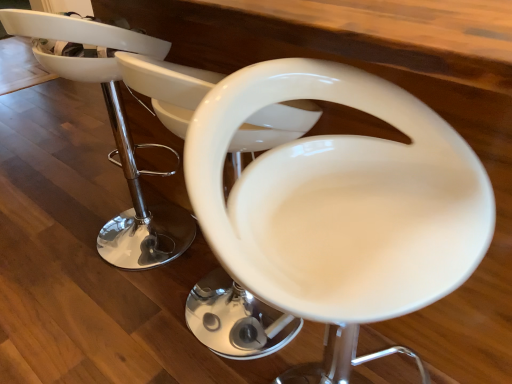
Question: Does white glossy bar stool at center, placed as the 2th feeding chair when sorted from back to front, have a lesser width compared to white glossy bar stool at center?

Choices:
 (A) no
 (B) yes

Answer: (B)

Question: Can you confirm if white glossy bar stool at center, placed as the 2th feeding chair when sorted from back to front, is taller than white glossy bar stool at center?

Choices:
 (A) yes
 (B) no

Answer: (B)

Question: Is white glossy bar stool at center, placed as the 2th feeding chair when sorted from back to front, positioned far away from white glossy bar stool at center?

Choices:
 (A) yes
 (B) no

Answer: (A)

Question: Does white glossy bar stool at center, marked as the 1th feeding chair in a front-to-back arrangement, have a smaller size compared to white glossy bar stool at center?

Choices:
 (A) yes
 (B) no

Answer: (A)

Question: From the image's perspective, is white glossy bar stool at center, marked as the 1th feeding chair in a front-to-back arrangement, located beneath white glossy bar stool at center?

Choices:
 (A) yes
 (B) no

Answer: (A)

Question: Is white glossy bar stool at center, marked as the 1th feeding chair in a front-to-back arrangement, at the left side of white glossy bar stool at center?

Choices:
 (A) no
 (B) yes

Answer: (A)

Question: Can you confirm if white glossy bar stool at center, which is the 1th feeding chair from back to front, is positioned to the left of white glossy bar stool at center, placed as the 2th feeding chair when sorted from back to front?

Choices:
 (A) no
 (B) yes

Answer: (B)

Question: Is white glossy bar stool at center, which is the 1th feeding chair from back to front, not within white glossy bar stool at center, marked as the 1th feeding chair in a front-to-back arrangement?

Choices:
 (A) yes
 (B) no

Answer: (A)

Question: Considering the relative sizes of white glossy bar stool at center, which is the 1th feeding chair from back to front, and white glossy bar stool at center, placed as the 2th feeding chair when sorted from back to front, in the image provided, is white glossy bar stool at center, which is the 1th feeding chair from back to front, smaller than white glossy bar stool at center, placed as the 2th feeding chair when sorted from back to front,?

Choices:
 (A) yes
 (B) no

Answer: (B)

Question: From the image's perspective, does white glossy bar stool at center, which is the 1th feeding chair from back to front, appear lower than white glossy bar stool at center, placed as the 2th feeding chair when sorted from back to front?

Choices:
 (A) no
 (B) yes

Answer: (A)

Question: Is white glossy bar stool at center, which is the 1th feeding chair from back to front, next to white glossy bar stool at center, placed as the 2th feeding chair when sorted from back to front, and touching it?

Choices:
 (A) no
 (B) yes

Answer: (A)

Question: Is white glossy bar stool at center, marked as the 1th feeding chair in a front-to-back arrangement, a part of white glossy bar stool at center, which is the 2th feeding chair from front to back?

Choices:
 (A) yes
 (B) no

Answer: (B)

Question: Does white glossy bar stool at center have a larger size compared to white glossy bar stool at center, which is the 2th feeding chair from front to back?

Choices:
 (A) no
 (B) yes

Answer: (A)